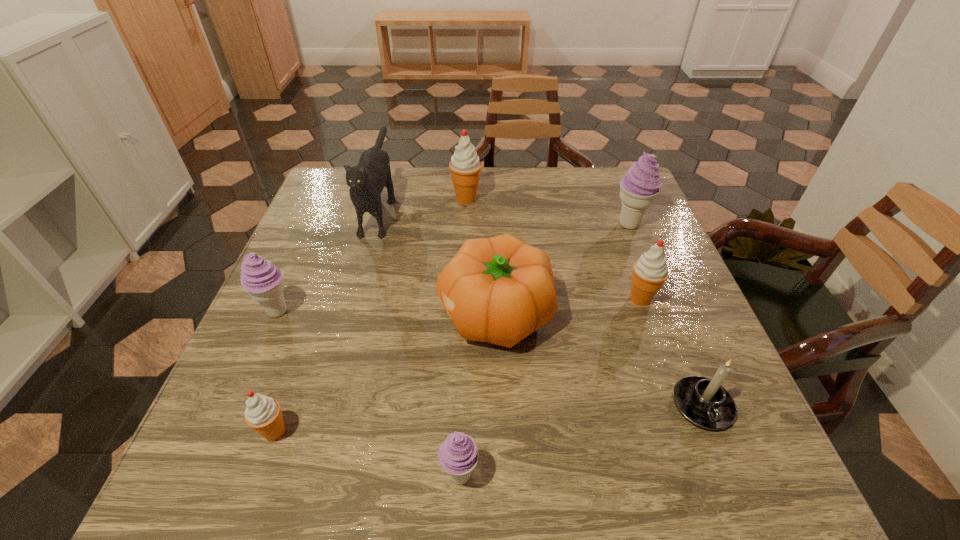
I want to click on vacant position located 0.200m on the carved face of the pumpkin, so click(x=346, y=314).

Where is `free space located on the carved face of the pumpkin`? This screenshot has height=540, width=960. free space located on the carved face of the pumpkin is located at coordinates (349, 314).

You are a GUI agent. You are given a task and a screenshot of the screen. Output one action in this format:
    pyautogui.click(x=<x>, y=<y>)
    Task: Click on the free region located on the left of the second farthest red icecream
    Image resolution: width=960 pixels, height=540 pixels.
    Given the screenshot: What is the action you would take?
    pyautogui.click(x=476, y=299)

At what (x,y) coordinates should I click in order to perform the action: click on vacant space located on the front of the second biggest purple icecream. Please return your answer as a coordinate pair (x, y). Looking at the image, I should click on (232, 414).

Where is `vacant space situated 0.080m on the left of the fifth farthest icecream`? Image resolution: width=960 pixels, height=540 pixels. vacant space situated 0.080m on the left of the fifth farthest icecream is located at coordinates (213, 432).

Where is `free space located on the left of the smallest purple icecream`? This screenshot has height=540, width=960. free space located on the left of the smallest purple icecream is located at coordinates (278, 475).

The image size is (960, 540). I want to click on cat located in the far edge section of the desktop, so click(366, 180).

Where is `icecream that is at the far edge`? Image resolution: width=960 pixels, height=540 pixels. icecream that is at the far edge is located at coordinates (465, 167).

What are the coordinates of `cat present at the left edge` in the screenshot? It's located at (366, 180).

This screenshot has width=960, height=540. I want to click on candle holder present at the right edge, so click(x=704, y=402).